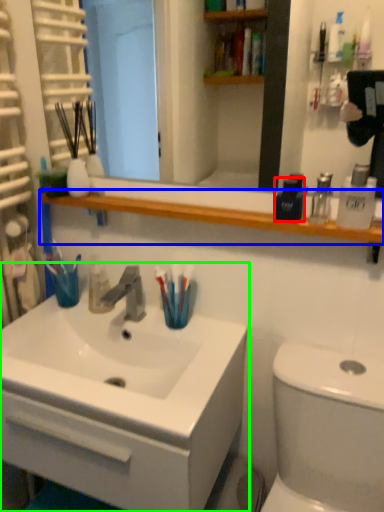
Question: Considering the real-world distances, which object is farthest from mouthwash (highlighted by a red box)? balustrade (highlighted by a blue box) or bathroom cabinet (highlighted by a green box)?

Choices:
 (A) balustrade
 (B) bathroom cabinet

Answer: (B)